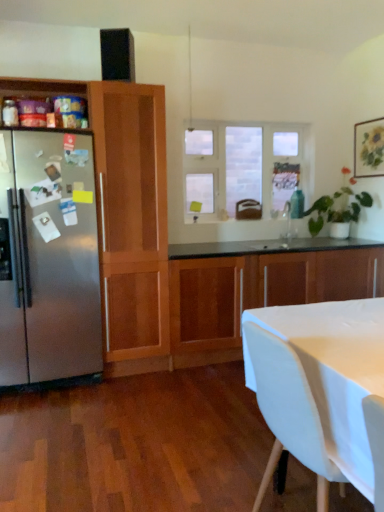
Question: Considering the relative sizes of white fabric chair at lower right and clear glass window at center in the image provided, is white fabric chair at lower right shorter than clear glass window at center?

Choices:
 (A) no
 (B) yes

Answer: (B)

Question: From a real-world perspective, is white fabric chair at lower right positioned under clear glass window at center based on gravity?

Choices:
 (A) yes
 (B) no

Answer: (A)

Question: Could you tell me if white fabric chair at lower right is turned towards clear glass window at center?

Choices:
 (A) yes
 (B) no

Answer: (B)

Question: Is white fabric chair at lower right bigger than clear glass window at center?

Choices:
 (A) no
 (B) yes

Answer: (B)

Question: From the image's perspective, is white fabric chair at lower right under clear glass window at center?

Choices:
 (A) no
 (B) yes

Answer: (B)

Question: Does point (34, 286) appear closer or farther from the camera than point (296, 370)?

Choices:
 (A) farther
 (B) closer

Answer: (A)

Question: Is satin stainless steel refrigerator at left bigger or smaller than white fabric chair at lower right?

Choices:
 (A) big
 (B) small

Answer: (A)

Question: Considering their positions, is satin stainless steel refrigerator at left located in front of or behind white fabric chair at lower right?

Choices:
 (A) behind
 (B) front

Answer: (A)

Question: Considering the positions of satin stainless steel refrigerator at left and white fabric chair at lower right in the image, is satin stainless steel refrigerator at left wider or thinner than white fabric chair at lower right?

Choices:
 (A) thin
 (B) wide

Answer: (B)

Question: Would you say satin stainless steel refrigerator at left is inside or outside wooden cabinet at center, the 1th cabinetry from the right?

Choices:
 (A) outside
 (B) inside

Answer: (A)

Question: Considering the positions of satin stainless steel refrigerator at left and wooden cabinet at center, the second cabinetry positioned from the left, in the image, is satin stainless steel refrigerator at left wider or thinner than wooden cabinet at center, the second cabinetry positioned from the left,?

Choices:
 (A) thin
 (B) wide

Answer: (A)

Question: From a real-world perspective, relative to wooden cabinet at center, the second cabinetry positioned from the left, is satin stainless steel refrigerator at left vertically above or below?

Choices:
 (A) below
 (B) above

Answer: (B)

Question: Is point (29, 162) positioned closer to the camera than point (382, 260)?

Choices:
 (A) closer
 (B) farther

Answer: (A)

Question: From a real-world perspective, relative to wooden cabinet at center, the 1th cabinetry from the right, is clear glass window at center vertically above or below?

Choices:
 (A) below
 (B) above

Answer: (B)

Question: In terms of width, does clear glass window at center look wider or thinner when compared to wooden cabinet at center, the second cabinetry positioned from the left?

Choices:
 (A) thin
 (B) wide

Answer: (A)